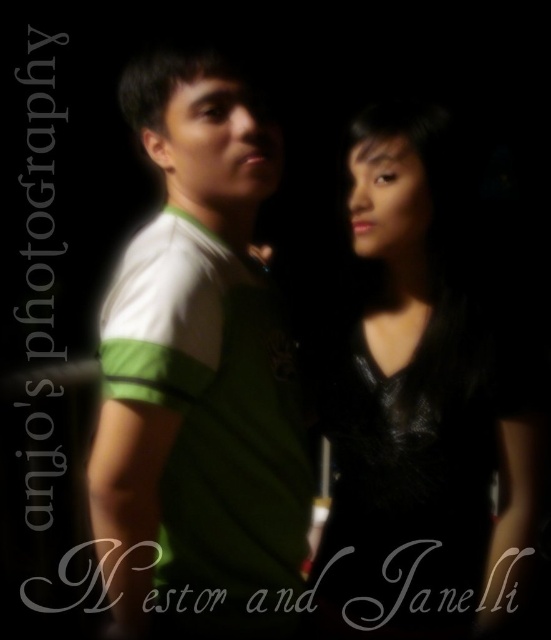
Describe the element at coordinates (198, 376) in the screenshot. The image size is (551, 640). I see `green jersey at center` at that location.

Is point (196, 595) farther from viewer compared to point (442, 209)?

No, (196, 595) is closer to viewer.

Locate an element on the screen. This screenshot has height=640, width=551. green jersey at center is located at coordinates (198, 376).